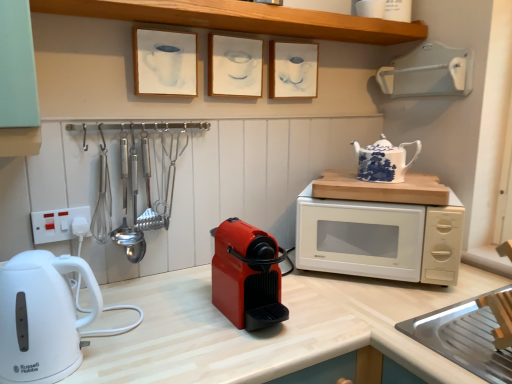
This screenshot has height=384, width=512. Identify the location of matte plastic coffee machine at center, which is the first home appliance in right-to-left order. (247, 275).

Image resolution: width=512 pixels, height=384 pixels. I want to click on white paper picture frame at upper center, which is counted as the third picture frame, starting from the right, so click(x=165, y=62).

The height and width of the screenshot is (384, 512). What do you see at coordinates (242, 19) in the screenshot?
I see `wooden at upper center` at bounding box center [242, 19].

Image resolution: width=512 pixels, height=384 pixels. I want to click on matte plastic coffee machine at center, which is the first home appliance in right-to-left order, so click(247, 275).

Can you tell me how much blue and white porcelain teapot at upper right and matte white picture frame at center, positioned as the 2th picture frame in right-to-left order, differ in facing direction?

There is a 43.7-degree angle between the facing directions of blue and white porcelain teapot at upper right and matte white picture frame at center, positioned as the 2th picture frame in right-to-left order.

You are a GUI agent. You are given a task and a screenshot of the screen. Output one action in this format:
    pyautogui.click(x=<x>, y=<y>)
    Task: Click on the 1st picture frame behind when counting from the blue and white porcelain teapot at upper right
    
    Given the screenshot: What is the action you would take?
    pyautogui.click(x=234, y=66)

From a real-world perspective, which object stands above the other?

matte white picture frame at center, positioned as the 2th picture frame in right-to-left order.

Can you confirm if blue and white porcelain teapot at upper right is positioned to the right of matte white picture frame at center, the second picture frame viewed from the left?

Correct, you'll find blue and white porcelain teapot at upper right to the right of matte white picture frame at center, the second picture frame viewed from the left.

Which object is positioned more to the right, blue and white porcelain teapot at upper right or white glossy electric kettle at left, the first home appliance from the left?

blue and white porcelain teapot at upper right.

Where is `the 2nd home appliance in front of the blue and white porcelain teapot at upper right, counting from the anchor's position`? This screenshot has height=384, width=512. the 2nd home appliance in front of the blue and white porcelain teapot at upper right, counting from the anchor's position is located at coordinates (41, 317).

From a real-world perspective, is blue and white porcelain teapot at upper right positioned under white glossy electric kettle at left, which ranks as the second home appliance in right-to-left order, based on gravity?

No, from a real-world perspective, blue and white porcelain teapot at upper right is not under white glossy electric kettle at left, which ranks as the second home appliance in right-to-left order.

Considering the relative sizes of blue and white porcelain teapot at upper right and white glossy electric kettle at left, the first home appliance from the left, in the image provided, is blue and white porcelain teapot at upper right shorter than white glossy electric kettle at left, the first home appliance from the left,?

Indeed, blue and white porcelain teapot at upper right has a lesser height compared to white glossy electric kettle at left, the first home appliance from the left.

Which is more to the right, white glossy electric kettle at left, the first home appliance from the left, or blue and white porcelain teapot at upper right?

blue and white porcelain teapot at upper right.

Between white glossy electric kettle at left, which ranks as the second home appliance in right-to-left order, and blue and white porcelain teapot at upper right, which one has more height?

Standing taller between the two is white glossy electric kettle at left, which ranks as the second home appliance in right-to-left order.

From a real-world perspective, relative to blue and white porcelain teapot at upper right, is white glossy electric kettle at left, which ranks as the second home appliance in right-to-left order, vertically above or below?

white glossy electric kettle at left, which ranks as the second home appliance in right-to-left order, is situated lower than blue and white porcelain teapot at upper right in the real world.

How different are the orientations of wooden at upper center and white matte microwave at right in degrees?

wooden at upper center and white matte microwave at right are facing 45.7 degrees away from each other.

Which of these two, wooden at upper center or white matte microwave at right, is wider?

Wider between the two is white matte microwave at right.

From the image's perspective, which is below, wooden at upper center or white matte microwave at right?

white matte microwave at right.

Based on the photo, would you say wooden at upper center is outside white matte microwave at right?

Yes, wooden at upper center is outside of white matte microwave at right.

Are white matte microwave at right and white paper picture frame at upper center, which is counted as the third picture frame, starting from the right, far apart?

No, there isn't a large distance between white matte microwave at right and white paper picture frame at upper center, which is counted as the third picture frame, starting from the right.

Would you say white matte microwave at right is outside white paper picture frame at upper center, which is counted as the third picture frame, starting from the right?

Yes, white matte microwave at right is not within white paper picture frame at upper center, which is counted as the third picture frame, starting from the right.

Is white matte microwave at right thinner than white paper picture frame at upper center, which is counted as the third picture frame, starting from the right?

No, white matte microwave at right is not thinner than white paper picture frame at upper center, which is counted as the third picture frame, starting from the right.

From the image's perspective, which one is positioned higher, white matte microwave at right or white paper picture frame at upper center, marked as the 1th picture frame in a left-to-right arrangement?

white paper picture frame at upper center, marked as the 1th picture frame in a left-to-right arrangement, appears higher in the image.

What's the angular difference between matte white picture frame at upper center, the third picture frame positioned from the left, and white paper picture frame at upper center, marked as the 1th picture frame in a left-to-right arrangement,'s facing directions?

0.656 degrees separate the facing orientations of matte white picture frame at upper center, the third picture frame positioned from the left, and white paper picture frame at upper center, marked as the 1th picture frame in a left-to-right arrangement.

From a real-world perspective, is matte white picture frame at upper center, the third picture frame positioned from the left, above or below white paper picture frame at upper center, marked as the 1th picture frame in a left-to-right arrangement?

Clearly, from a real-world perspective, matte white picture frame at upper center, the third picture frame positioned from the left, is below white paper picture frame at upper center, marked as the 1th picture frame in a left-to-right arrangement.

Is matte white picture frame at upper center, arranged as the first picture frame when viewed from the right, aimed at white paper picture frame at upper center, which is counted as the third picture frame, starting from the right?

No, matte white picture frame at upper center, arranged as the first picture frame when viewed from the right, is not oriented towards white paper picture frame at upper center, which is counted as the third picture frame, starting from the right.

From the image's perspective, is matte white picture frame at upper center, arranged as the first picture frame when viewed from the right, located above or below white paper picture frame at upper center, which is counted as the third picture frame, starting from the right?

Based on their image positions, matte white picture frame at upper center, arranged as the first picture frame when viewed from the right, is located above white paper picture frame at upper center, which is counted as the third picture frame, starting from the right.

Which object is positioned more to the right, white glossy electric kettle at left, the first home appliance from the left, or white paper picture frame at upper center, marked as the 1th picture frame in a left-to-right arrangement?

white paper picture frame at upper center, marked as the 1th picture frame in a left-to-right arrangement, is more to the right.

Is white glossy electric kettle at left, which ranks as the second home appliance in right-to-left order, inside or outside of white paper picture frame at upper center, which is counted as the third picture frame, starting from the right?

white glossy electric kettle at left, which ranks as the second home appliance in right-to-left order, is not inside white paper picture frame at upper center, which is counted as the third picture frame, starting from the right, it's outside.

From a real-world perspective, between white glossy electric kettle at left, the first home appliance from the left, and white paper picture frame at upper center, which is counted as the third picture frame, starting from the right, who is vertically higher?

white paper picture frame at upper center, which is counted as the third picture frame, starting from the right, from a real-world perspective.

Which picture frame is the 2nd one when counting from the left side of the blue and white porcelain teapot at upper right? Please provide its 2D coordinates.

[(234, 66)]

This screenshot has height=384, width=512. In the image, there is a white glossy electric kettle at left, the first home appliance from the left. Identify the location of kitchen appliance above it (from the image's perspective). (384, 160).

From the image, which object appears to be farther from matte white picture frame at center, positioned as the 2th picture frame in right-to-left order, matte white picture frame at upper center, arranged as the first picture frame when viewed from the right, or white plastic electric outlet at left?

Among the two, white plastic electric outlet at left is located further to matte white picture frame at center, positioned as the 2th picture frame in right-to-left order.

Estimate the real-world distances between objects in this image. Which object is closer to matte plastic coffee machine at center, which is the first home appliance in right-to-left order, matte white picture frame at center, the second picture frame viewed from the left, or matte white picture frame at upper center, the third picture frame positioned from the left?

matte white picture frame at center, the second picture frame viewed from the left, lies closer to matte plastic coffee machine at center, which is the first home appliance in right-to-left order, than the other object.

Considering their positions, is matte plastic coffee machine at center, which is the first home appliance in right-to-left order, positioned closer to matte white picture frame at upper center, the third picture frame positioned from the left, than white paper picture frame at upper center, which is counted as the third picture frame, starting from the right?

Based on the image, white paper picture frame at upper center, which is counted as the third picture frame, starting from the right, appears to be nearer to matte white picture frame at upper center, the third picture frame positioned from the left.

Based on their spatial positions, is white paper picture frame at upper center, which is counted as the third picture frame, starting from the right, or blue and white porcelain teapot at upper right further from white matte microwave at right?

The object further to white matte microwave at right is white paper picture frame at upper center, which is counted as the third picture frame, starting from the right.

Looking at the image, which one is located further to wooden at upper center, white plastic electric outlet at left or matte white picture frame at upper center, arranged as the first picture frame when viewed from the right?

The object further to wooden at upper center is white plastic electric outlet at left.

Based on their spatial positions, is white paper picture frame at upper center, which is counted as the third picture frame, starting from the right, or white glossy electric kettle at left, which ranks as the second home appliance in right-to-left order, further from matte white picture frame at upper center, arranged as the first picture frame when viewed from the right?

white glossy electric kettle at left, which ranks as the second home appliance in right-to-left order, is positioned further to the anchor matte white picture frame at upper center, arranged as the first picture frame when viewed from the right.

Looking at the image, which one is located closer to white paper picture frame at upper center, marked as the 1th picture frame in a left-to-right arrangement, white matte microwave at right or matte white picture frame at upper center, arranged as the first picture frame when viewed from the right?

matte white picture frame at upper center, arranged as the first picture frame when viewed from the right, is positioned closer to the anchor white paper picture frame at upper center, marked as the 1th picture frame in a left-to-right arrangement.

Which object lies further to the anchor point wooden at upper center, white matte microwave at right or white glossy electric kettle at left, the first home appliance from the left?

Based on the image, white glossy electric kettle at left, the first home appliance from the left, appears to be further to wooden at upper center.

The image size is (512, 384). I want to click on kitchen appliance that lies between wooden at upper center and white matte microwave at right from top to bottom, so click(x=384, y=160).

Image resolution: width=512 pixels, height=384 pixels. In order to click on shelf located between matte white picture frame at center, the second picture frame viewed from the left, and blue and white porcelain teapot at upper right in the left-right direction in this screenshot , I will do `click(242, 19)`.

Locate an element on the screen. Image resolution: width=512 pixels, height=384 pixels. home appliance between matte white picture frame at upper center, arranged as the first picture frame when viewed from the right, and white glossy electric kettle at left, which ranks as the second home appliance in right-to-left order, from top to bottom is located at coordinates (247, 275).

Identify the location of kitchen appliance between matte white picture frame at center, positioned as the 2th picture frame in right-to-left order, and matte plastic coffee machine at center, the 2th home appliance when ordered from left to right, vertically. (384, 160).